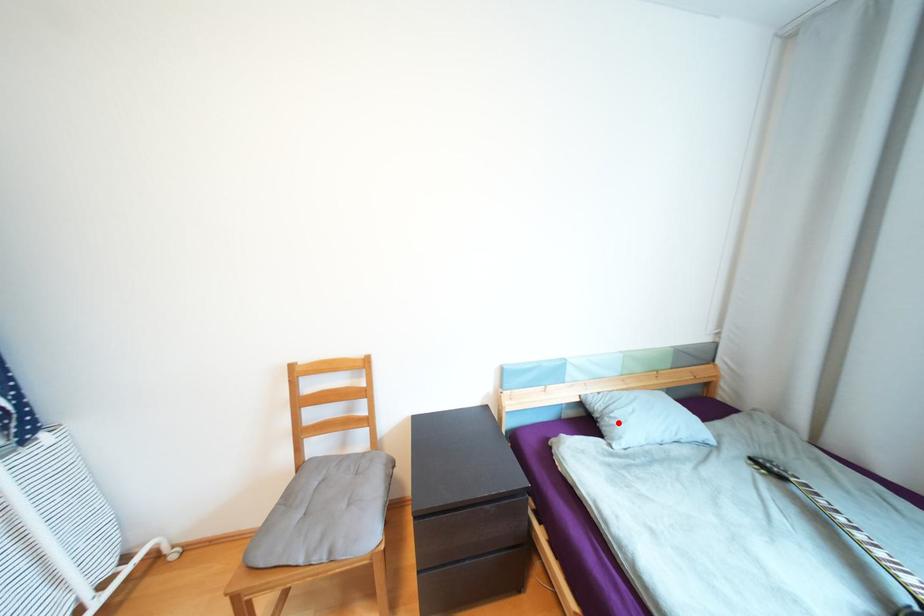
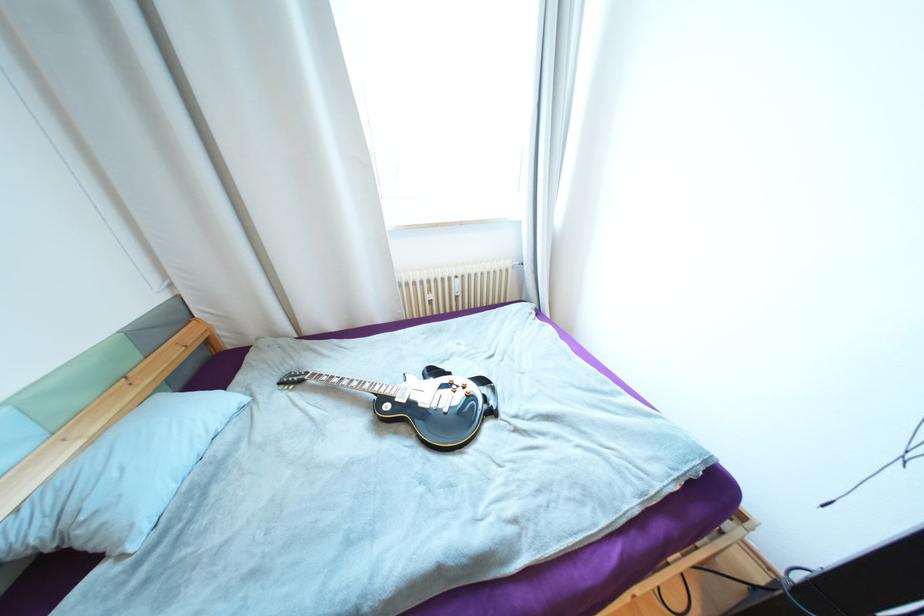
Find the pixel in the second image that matches the highlighted location in the first image.

(101, 525)